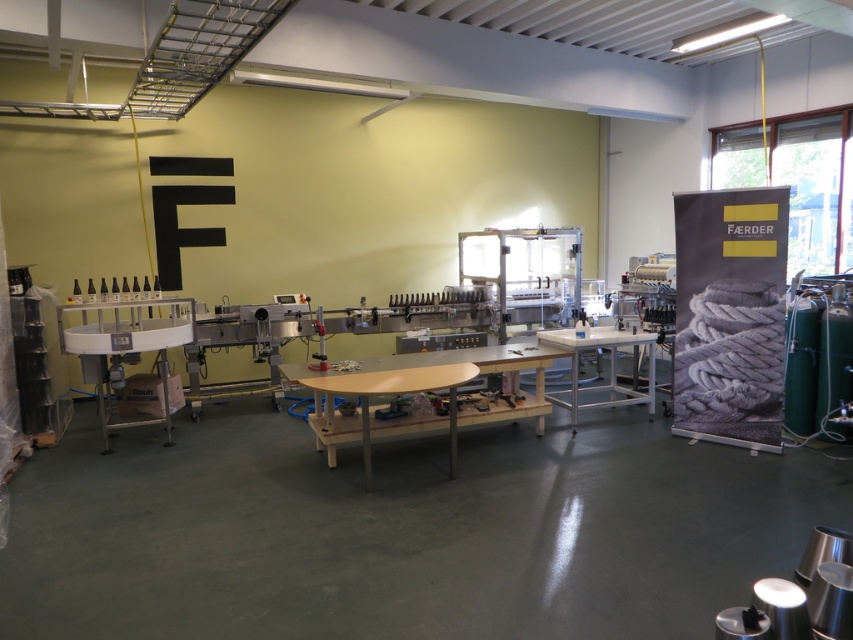
Locate an element on the screen. The image size is (853, 640). metallic gray table at left is located at coordinates click(x=125, y=349).

Locate an element on the screen. This screenshot has height=640, width=853. metallic gray table at left is located at coordinates (125, 349).

Can you confirm if light brown wooden table at center is positioned below metallic gray table at left?

Yes.

Can you confirm if light brown wooden table at center is positioned above metallic gray table at left?

No.

At what (x,y) coordinates should I click in order to perform the action: click on light brown wooden table at center. Please return your answer as a coordinate pair (x, y). This screenshot has height=640, width=853. Looking at the image, I should click on tap(425, 392).

Identify the location of light brown wooden table at center. The height and width of the screenshot is (640, 853). (425, 392).

Who is positioned more to the right, light brown wooden table at center or metallic silver table at center?

metallic silver table at center is more to the right.

Is point (486, 369) farther from camera compared to point (650, 362)?

No, it is in front of (650, 362).

At what (x,y) coordinates should I click in order to perform the action: click on light brown wooden table at center. Please return your answer as a coordinate pair (x, y). Image resolution: width=853 pixels, height=640 pixels. Looking at the image, I should click on (425, 392).